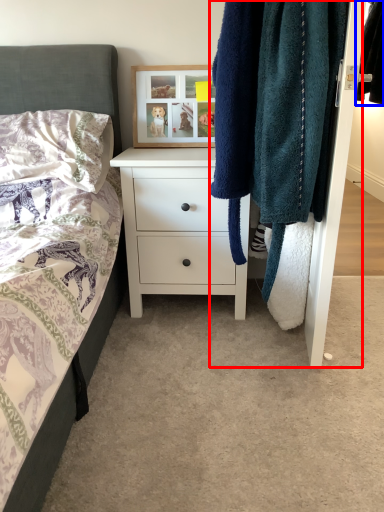
Question: Which object is further to the camera taking this photo, closet (highlighted by a red box) or clothing (highlighted by a blue box)?

Choices:
 (A) closet
 (B) clothing

Answer: (B)